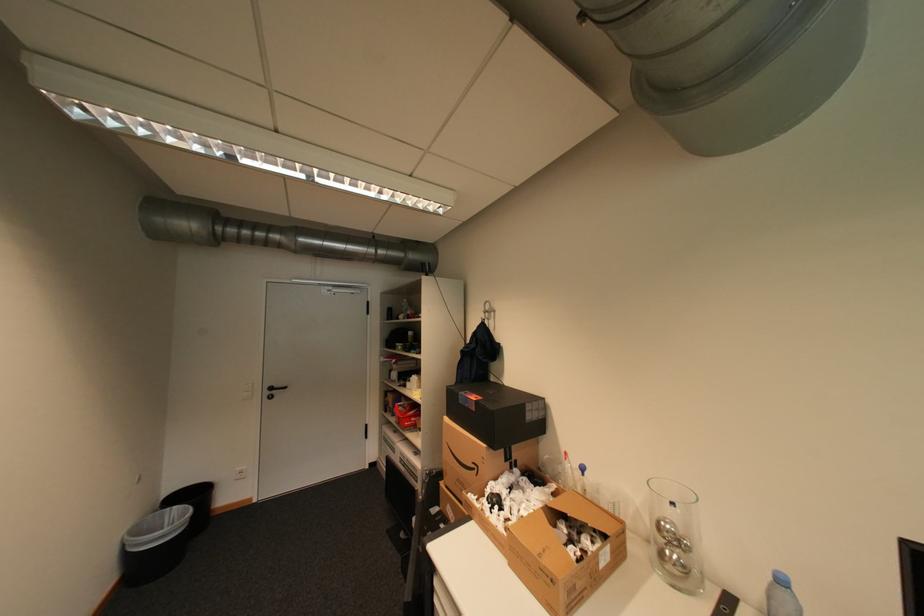
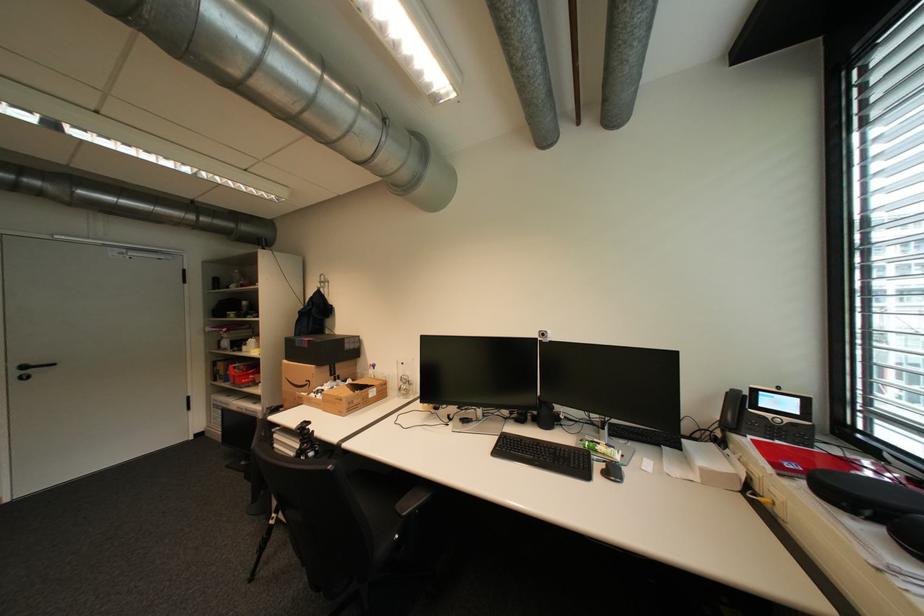
Find the pixel in the second image that matches [484,468] in the first image.

(317, 383)